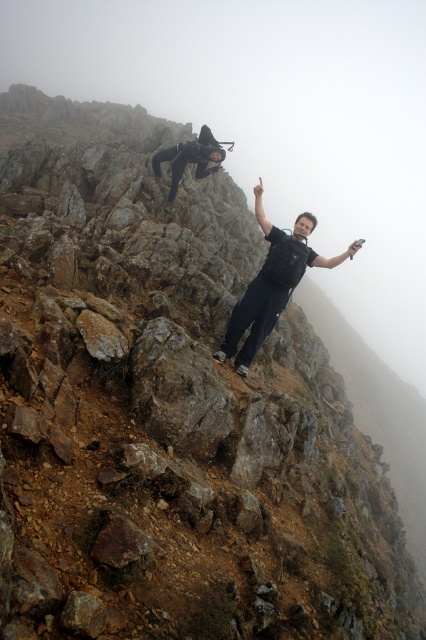
You are a hiker planning to traverse the rocky terrain in the image. You notice a point marked at coordinates (271, 284). What object is located exactly at that point?

The object located exactly at point (271, 284) is black matte pants at center.

You are an observer looking at the mountain terrain. You notice two dark clothing items at the scene. Which one is taller, the black matte pants at center or the black matte wetsuit at upper center?

The black matte pants at center is much taller than the black matte wetsuit at upper center according to the description.